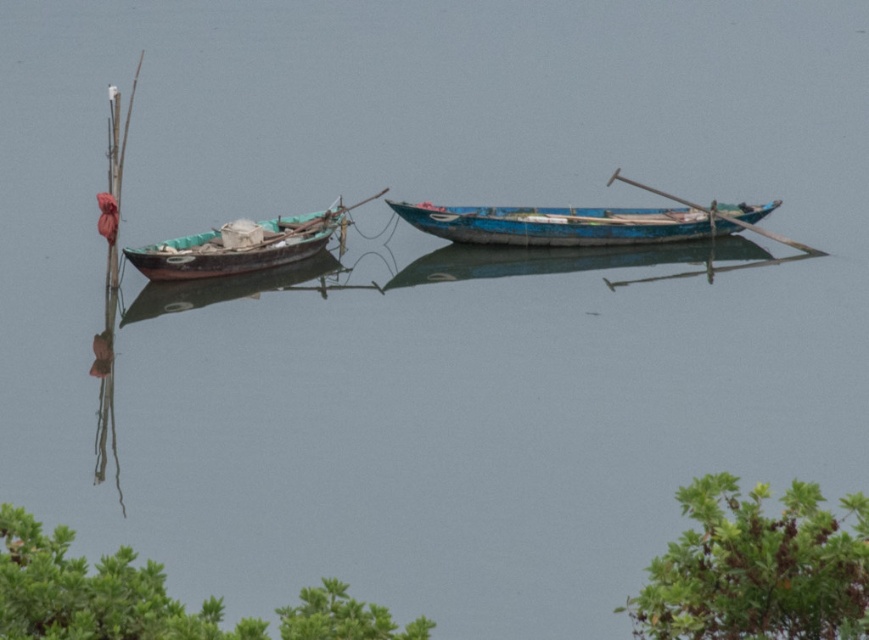
Between green leafy tree at lower left and blue wooden boat at center, which one appears on the left side from the viewer's perspective?

Positioned to the left is green leafy tree at lower left.

Between green leafy tree at lower left and blue wooden boat at center, which one is positioned higher?

Positioned higher is blue wooden boat at center.

Describe the element at coordinates (93, 593) in the screenshot. I see `green leafy tree at lower left` at that location.

This screenshot has height=640, width=869. What are the coordinates of `green leafy tree at lower left` in the screenshot? It's located at (93, 593).

Does green leafy tree at lower left come behind wooden boat at left?

No, green leafy tree at lower left is in front of wooden boat at left.

Between green leafy tree at lower left and wooden boat at left, which one appears on the left side from the viewer's perspective?

From the viewer's perspective, wooden boat at left appears more on the left side.

Is point (330, 589) more distant than point (256, 260)?

No.

Image resolution: width=869 pixels, height=640 pixels. Find the location of `green leafy tree at lower left`. green leafy tree at lower left is located at coordinates (93, 593).

Who is more distant from viewer, (558, 209) or (247, 250)?

The point (558, 209) is behind.

Can you confirm if blue wooden boat at center is shorter than wooden boat at left?

Yes.

What do you see at coordinates (562, 225) in the screenshot? I see `blue wooden boat at center` at bounding box center [562, 225].

I want to click on blue wooden boat at center, so click(x=562, y=225).